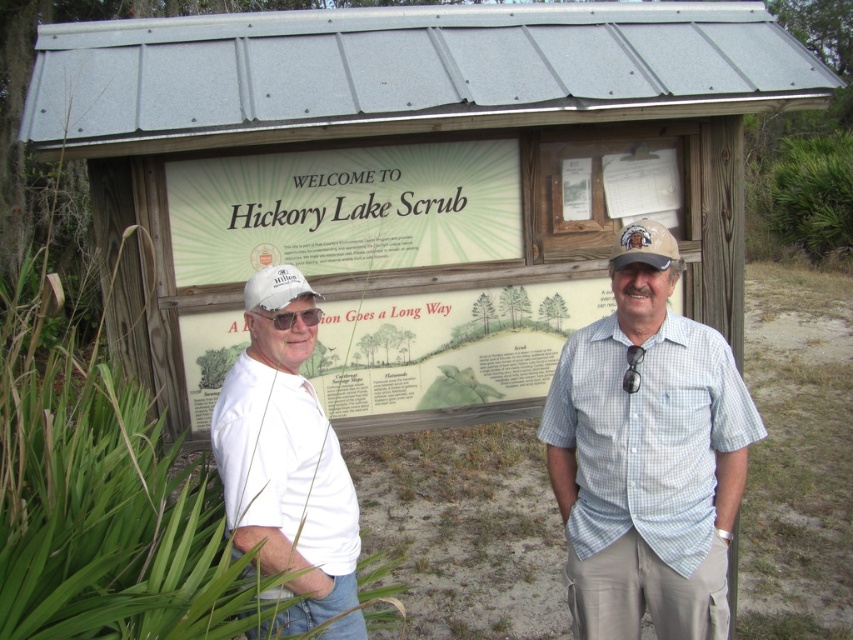
The height and width of the screenshot is (640, 853). What do you see at coordinates (276, 288) in the screenshot? I see `white matte baseball cap at left` at bounding box center [276, 288].

Between white matte baseball cap at left and matte white goggles at center, which one has more height?

With more height is white matte baseball cap at left.

The width and height of the screenshot is (853, 640). Find the location of `white matte baseball cap at left`. white matte baseball cap at left is located at coordinates (276, 288).

Between wooden signboard at center and white matte baseball cap at left, which one has more height?

Standing taller between the two is wooden signboard at center.

Does point (515, 396) come in front of point (283, 280)?

No, it is behind (283, 280).

The width and height of the screenshot is (853, 640). Identify the location of wooden signboard at center. (407, 180).

Where is `wooden signboard at center`? The width and height of the screenshot is (853, 640). wooden signboard at center is located at coordinates (407, 180).

Which is more to the right, wooden signboard at center or light blue checkered shirt at center?

light blue checkered shirt at center is more to the right.

Does point (393, 68) come closer to viewer compared to point (584, 560)?

No, (393, 68) is behind (584, 560).

The height and width of the screenshot is (640, 853). I want to click on wooden signboard at center, so click(407, 180).